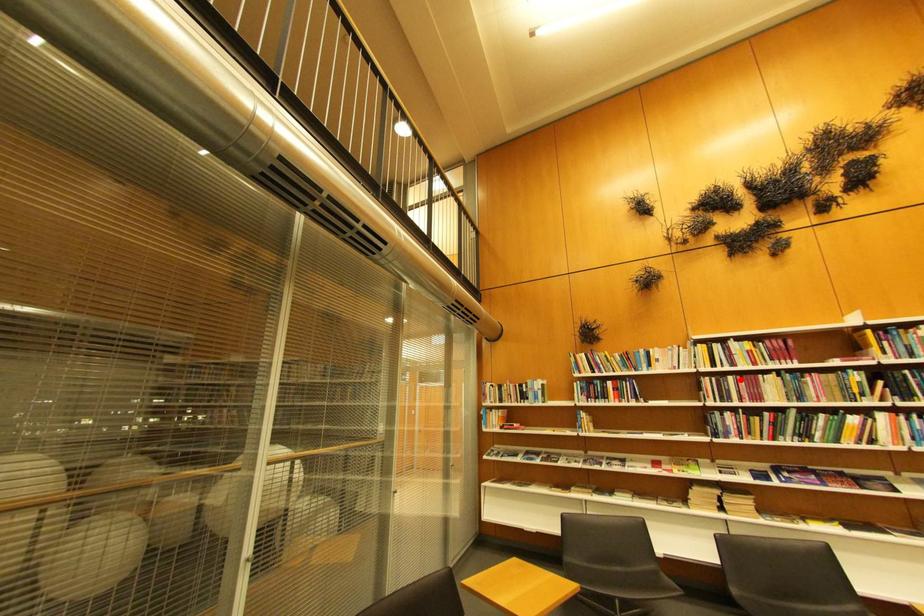
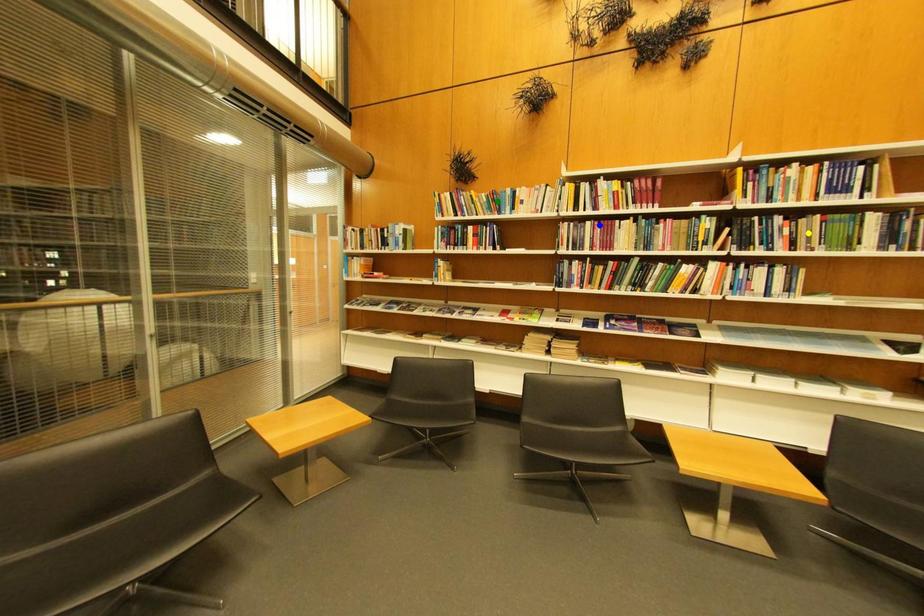
Question: I am providing you with two images of the same scene from different viewpoints. A red point is marked on the first image. You are given multiple points on the second image. Which spot in image 2 lines up with the point in image 1?

Choices:
 (A) yellow point
 (B) green point
 (C) blue point

Answer: (C)